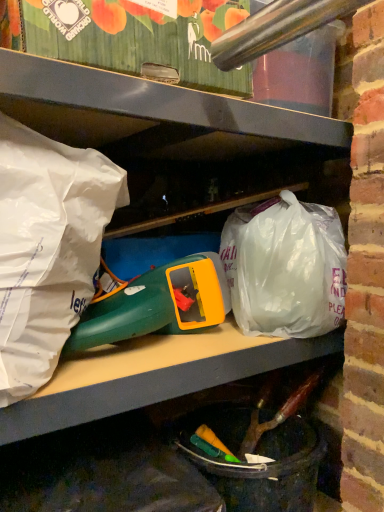
Question: In terms of size, does translucent plastic bag at center, the 1th plastic bag viewed from the right, appear bigger or smaller than green plastic toy at center?

Choices:
 (A) big
 (B) small

Answer: (A)

Question: Is point (288, 222) closer or farther from the camera than point (130, 329)?

Choices:
 (A) farther
 (B) closer

Answer: (A)

Question: Which object is positioned closest to the translucent plastic bag at center, which is the second plastic bag from left to right?

Choices:
 (A) white paper bag at left, which is the 1th plastic bag from front to back
 (B) green plastic toy at center

Answer: (B)

Question: Estimate the real-world distances between objects in this image. Which object is farther from the translucent plastic bag at center, the 1th plastic bag viewed from the right?

Choices:
 (A) green plastic toy at center
 (B) white paper bag at left, the second plastic bag positioned from the right

Answer: (B)